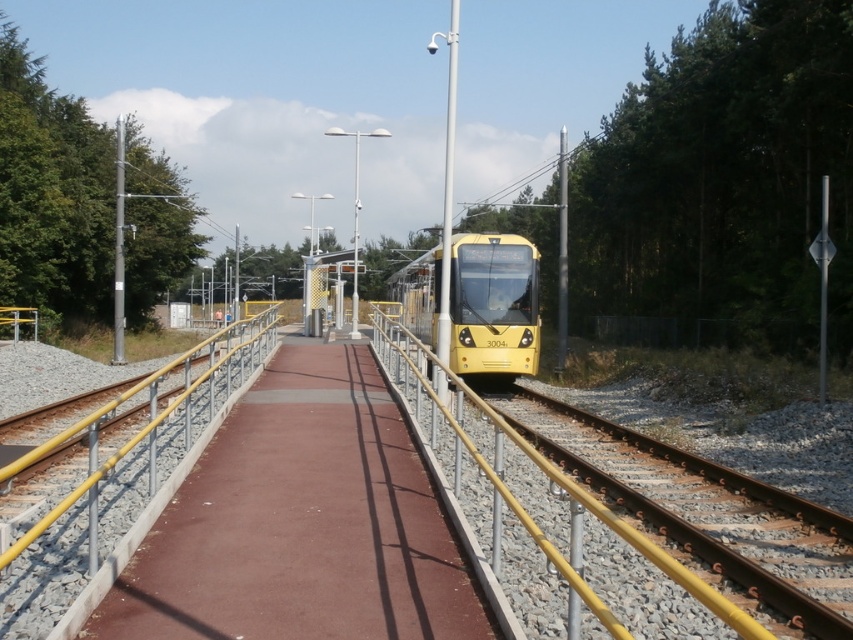
You are a delivery person carrying a large box and need to walk from the tram station entrance to the tram. You see the smooth concrete path at center and the yellow metallic rail at left. Which path should you choose to ensure you have enough space for your box?

The yellow metallic rail at left is wider than the smooth concrete path at center, so you should choose the yellow metallic rail at left to ensure enough space for your box.

You are standing at the tram station and want to walk to the smooth concrete path at center. Based on the coordinates provided, in which direction should you move from your current position at the tram platform?

The smooth concrete path at center is located at coordinates point (300, 524). Since you are on the tram platform, you should move towards the center of the platform where the path is situated.

You are standing at the tram station and want to walk to the smooth concrete path at center. Which direction should you move to reach it?

The smooth concrete path at center is located at coordinates point (300,524), so you should move towards the center of the platform to reach it.